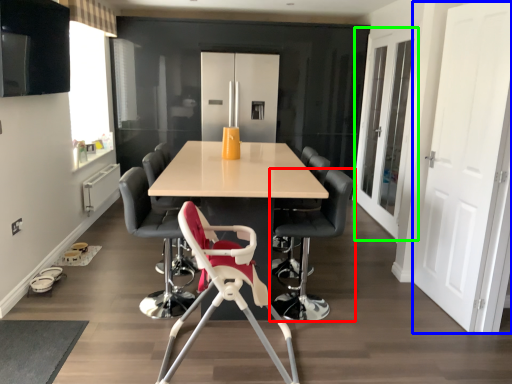
Question: Which object is the farthest from chair (highlighted by a red box)? Choose among these: door (highlighted by a blue box) or glass door (highlighted by a green box).

Choices:
 (A) door
 (B) glass door

Answer: (B)